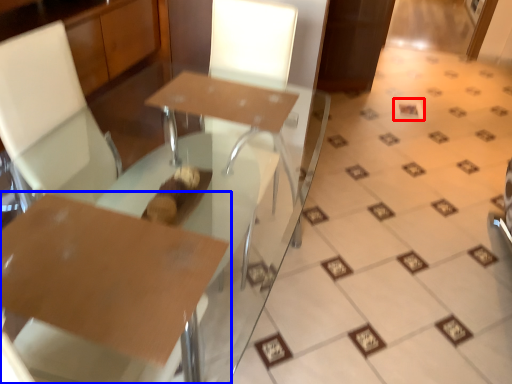
Question: Which point is closer to the camera, square (highlighted by a red box) or table (highlighted by a blue box)?

Choices:
 (A) square
 (B) table

Answer: (B)